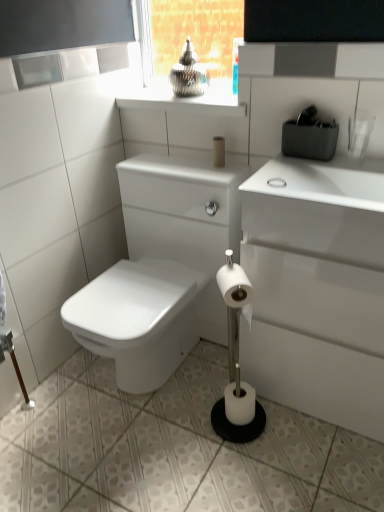
Locate an element on the screen. The image size is (384, 512). vacant region in front of white matte toilet paper at center, which is the second toilet paper in front-to-back order is located at coordinates (244, 458).